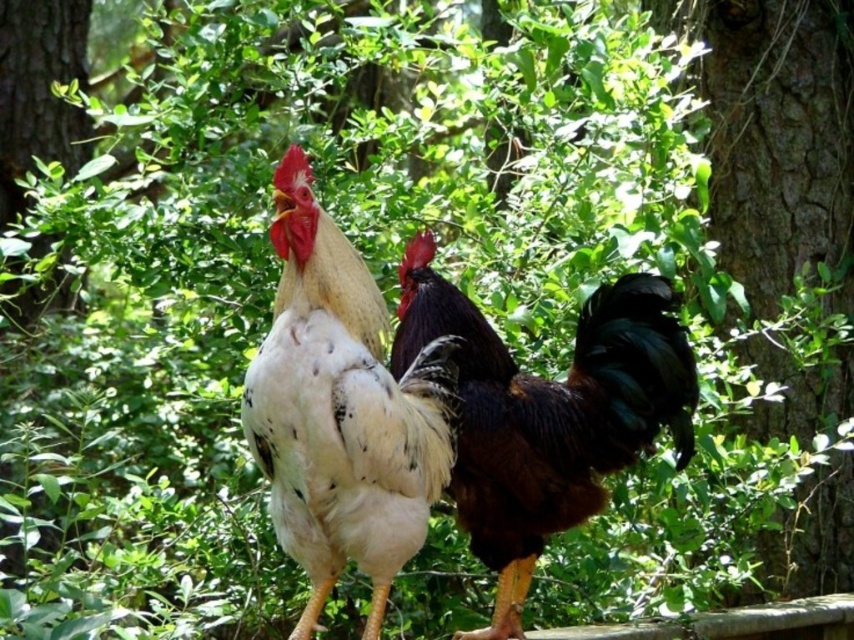
Question: Which point appears farthest from the camera in this image?

Choices:
 (A) tap(796, 90)
 (B) tap(525, 396)
 (C) tap(291, 269)

Answer: (A)

Question: Is rough bark tree at right positioned before shiny black rooster at center?

Choices:
 (A) yes
 (B) no

Answer: (B)

Question: Does rough bark tree at right appear over shiny black rooster at center?

Choices:
 (A) yes
 (B) no

Answer: (A)

Question: Does rough bark tree at right have a smaller size compared to white speckled feathers at center?

Choices:
 (A) yes
 (B) no

Answer: (B)

Question: Estimate the real-world distances between objects in this image. Which object is farther from the rough bark tree at right?

Choices:
 (A) shiny black rooster at center
 (B) white speckled feathers at center

Answer: (B)

Question: Which of the following is the farthest from the observer?

Choices:
 (A) white speckled feathers at center
 (B) shiny black rooster at center
 (C) rough bark tree at right

Answer: (C)